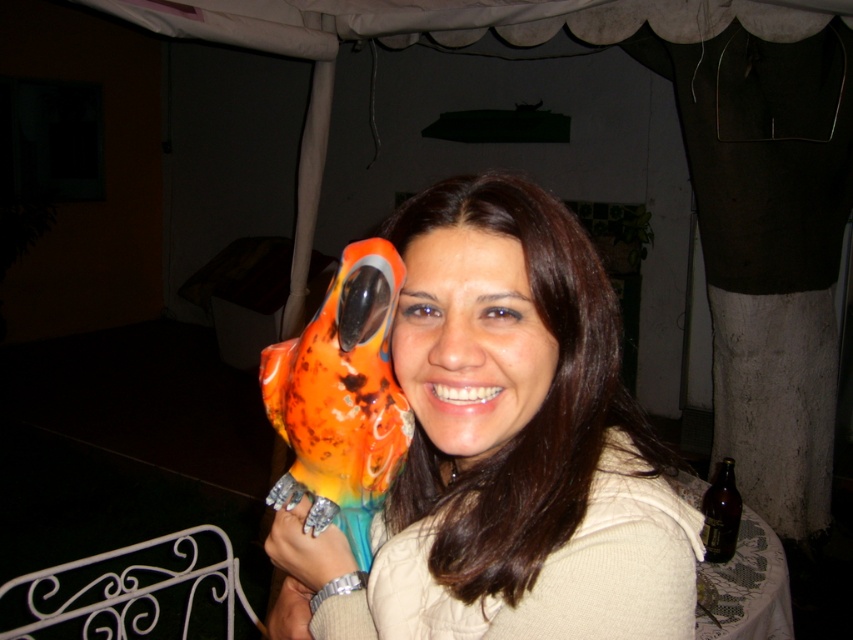
Question: Is matte ceramic parrot at center to the left of shiny plastic parrot at left from the viewer's perspective?

Choices:
 (A) no
 (B) yes

Answer: (A)

Question: Can you confirm if shiny plastic parrot at left is bigger than metallic ring at center?

Choices:
 (A) yes
 (B) no

Answer: (A)

Question: Which object appears closest to the camera in this image?

Choices:
 (A) matte ceramic parrot at center
 (B) metallic ring at center
 (C) shiny plastic parrot at left

Answer: (A)

Question: Does matte ceramic parrot at center have a greater width compared to metallic ring at center?

Choices:
 (A) yes
 (B) no

Answer: (A)

Question: Which point is closer to the camera taking this photo?

Choices:
 (A) (351, 484)
 (B) (426, 506)

Answer: (A)

Question: Which of the following is the farthest from the observer?

Choices:
 (A) (315, 538)
 (B) (355, 280)
 (C) (341, 592)

Answer: (C)